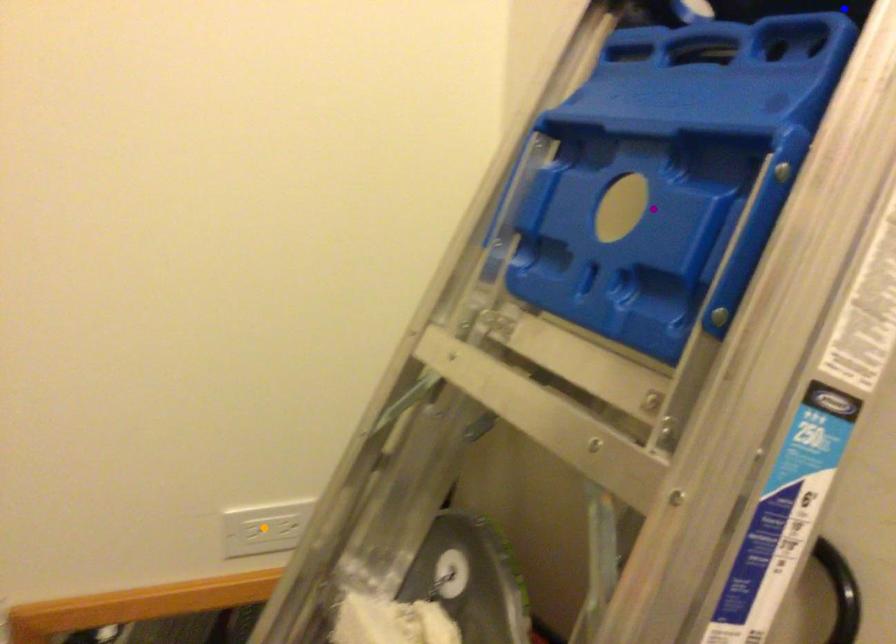
Order these from nearest to farthest:
orange point | blue point | purple point

1. blue point
2. purple point
3. orange point